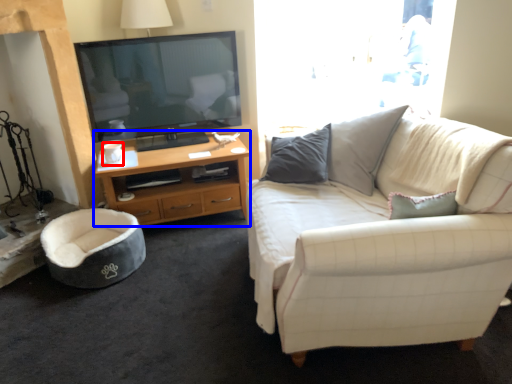
Question: Among these objects, which one is farthest to the camera, coffee cup (highlighted by a red box) or desk (highlighted by a blue box)?

Choices:
 (A) coffee cup
 (B) desk

Answer: (A)